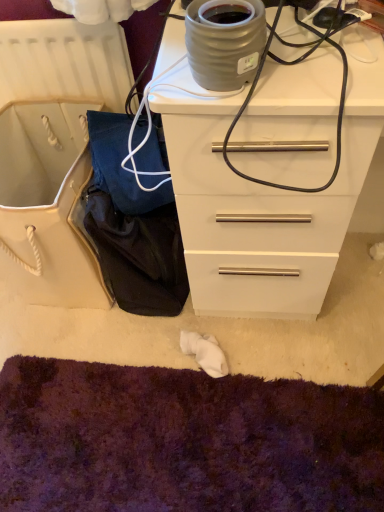
Find the location of `vacant area located to the right-hand side of matte gray ceramic pot at upper center`. vacant area located to the right-hand side of matte gray ceramic pot at upper center is located at coordinates (312, 64).